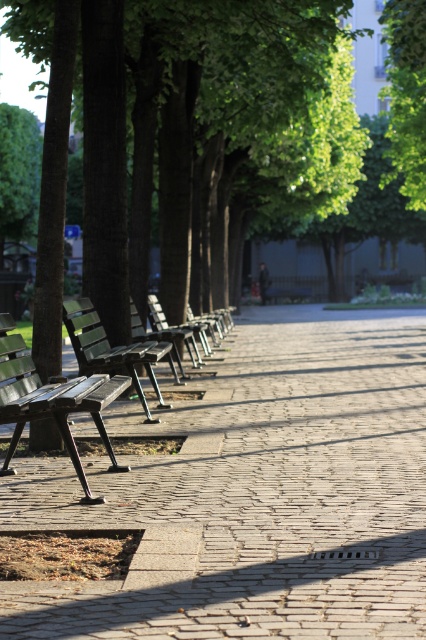
Question: Which object is farther from the camera taking this photo?

Choices:
 (A) wooden bench at center
 (B) brick paved walkway at center

Answer: (A)

Question: Is wooden park bench at left below wooden park bench at center?

Choices:
 (A) no
 (B) yes

Answer: (B)

Question: Which object is farther from the camera taking this photo?

Choices:
 (A) wooden bench at center
 (B) brick paved walkway at center

Answer: (A)

Question: Which of the following is the closest to the observer?

Choices:
 (A) wooden park bench at left
 (B) wooden bench at center
 (C) wooden park bench at center
 (D) brick paved walkway at center

Answer: (D)

Question: Can you confirm if brick paved walkway at center is positioned to the left of wooden bench at center?

Choices:
 (A) no
 (B) yes

Answer: (A)

Question: Does brick paved walkway at center appear on the right side of wooden park bench at center?

Choices:
 (A) no
 (B) yes

Answer: (B)